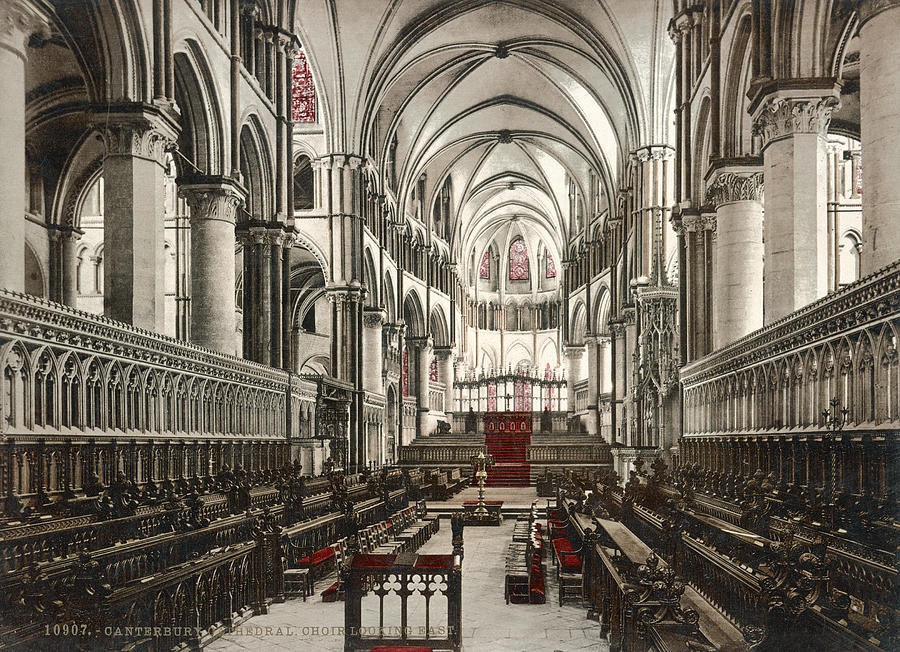
Where is `arch`? Image resolution: width=900 pixels, height=652 pixels. arch is located at coordinates (524, 152).